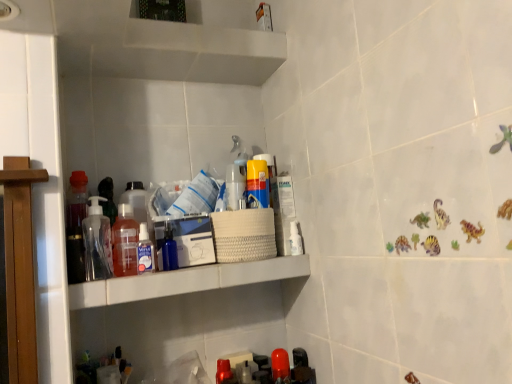
This screenshot has width=512, height=384. What do you see at coordinates (257, 184) in the screenshot? I see `matte plastic can at center, which ranks as the second toiletry in front-to-back order` at bounding box center [257, 184].

In order to face matte plastic can at center, which is counted as the 2th toiletry, starting from the back, should I rotate leftwards or rightwards?

To face it directly, rotate right by 0.769 degrees.

Locate an element on the screen. white plastic shelf at upper center is located at coordinates (185, 281).

What do you see at coordinates (295, 239) in the screenshot?
I see `white plastic bottle at upper right, which is the first toiletry from right to left` at bounding box center [295, 239].

The height and width of the screenshot is (384, 512). What do you see at coordinates (97, 242) in the screenshot?
I see `translucent plastic pump bottle at left, the 3th bottle when ordered from right to left` at bounding box center [97, 242].

Where is `translucent plastic bottle at center, the second bottle positioned from the right`? translucent plastic bottle at center, the second bottle positioned from the right is located at coordinates (125, 242).

Find the location of `matte plastic can at center, the second toiletry when ordered from right to left`. matte plastic can at center, the second toiletry when ordered from right to left is located at coordinates (257, 184).

Can you confirm if transparent plastic spray bottle at upper center, the 1th toiletry positioned from the front, is wider than matte plastic can at center, which is counted as the 2th toiletry, starting from the back?

In fact, transparent plastic spray bottle at upper center, the 1th toiletry positioned from the front, might be narrower than matte plastic can at center, which is counted as the 2th toiletry, starting from the back.

Does transparent plastic spray bottle at upper center, acting as the 3th toiletry starting from the right, have a smaller size compared to matte plastic can at center, which ranks as the second toiletry in front-to-back order?

Yes.

From a real-world perspective, who is located lower, transparent plastic spray bottle at upper center, positioned as the 3th toiletry in back-to-front order, or matte plastic can at center, the second toiletry from the left?

transparent plastic spray bottle at upper center, positioned as the 3th toiletry in back-to-front order, from a real-world perspective.

Measure the distance from transparent plastic spray bottle at upper center, the 1th toiletry when ordered from left to right, to matte plastic can at center, which is counted as the 2th toiletry, starting from the back.

A distance of 11.37 inches exists between transparent plastic spray bottle at upper center, the 1th toiletry when ordered from left to right, and matte plastic can at center, which is counted as the 2th toiletry, starting from the back.

Is white plastic shelf at upper center situated inside transparent plastic bottle at left, the fourth bottle from the right, or outside?

white plastic shelf at upper center is located beyond the bounds of transparent plastic bottle at left, the fourth bottle from the right.

Who is shorter, white plastic shelf at upper center or transparent plastic bottle at left, marked as the first bottle in a left-to-right arrangement?

With less height is white plastic shelf at upper center.

Considering the positions of point (200, 284) and point (67, 252), is point (200, 284) closer or farther from the camera than point (67, 252)?

Point (200, 284) appears to be farther away from the viewer than point (67, 252).

From the image's perspective, relative to transparent plastic bottle at left, the fourth bottle from the right, is white plastic shelf at upper center above or below?

Based on their image positions, white plastic shelf at upper center is located beneath transparent plastic bottle at left, the fourth bottle from the right.

In the scene shown: Is transparent plastic bottle at left, marked as the first bottle in a left-to-right arrangement, not close to translucent plastic bottle at center, the 4th bottle in the left-to-right sequence?

No, there isn't a large distance between transparent plastic bottle at left, marked as the first bottle in a left-to-right arrangement, and translucent plastic bottle at center, the 4th bottle in the left-to-right sequence.

Considering the relative sizes of transparent plastic bottle at left, marked as the first bottle in a left-to-right arrangement, and translucent plastic bottle at center, positioned as the first bottle in right-to-left order, in the image provided, is transparent plastic bottle at left, marked as the first bottle in a left-to-right arrangement, smaller than translucent plastic bottle at center, positioned as the first bottle in right-to-left order,?

Incorrect, transparent plastic bottle at left, marked as the first bottle in a left-to-right arrangement, is not smaller in size than translucent plastic bottle at center, positioned as the first bottle in right-to-left order.

From a real-world perspective, starting from the translucent plastic bottle at center, the 4th bottle in the left-to-right sequence, which bottle is the 1st one below it? Please provide its 2D coordinates.

[(76, 226)]

From the image's perspective, between transparent plastic bottle at left, marked as the first bottle in a left-to-right arrangement, and translucent plastic bottle at center, positioned as the first bottle in right-to-left order, which one is located above?

translucent plastic bottle at center, positioned as the first bottle in right-to-left order, from the image's perspective.

Based on their sizes in the image, would you say translucent plastic bottle at center, positioned as the first bottle in right-to-left order, is bigger or smaller than white plastic shelf at upper center?

In the image, translucent plastic bottle at center, positioned as the first bottle in right-to-left order, appears to be smaller than white plastic shelf at upper center.

You are a GUI agent. You are given a task and a screenshot of the screen. Output one action in this format:
    pyautogui.click(x=<x>, y=<y>)
    Task: Click on the 4th bottle positioned above the white plastic shelf at upper center (from a real-world perspective)
    
    Given the screenshot: What is the action you would take?
    pyautogui.click(x=234, y=185)

How many degrees apart are the facing directions of translucent plastic bottle at center, the 4th bottle in the left-to-right sequence, and white plastic shelf at upper center?

0.00226 degrees.

Is translucent plastic bottle at center, positioned as the first bottle in right-to-left order, aimed at white plastic bottle at upper right, which is the first toiletry from right to left?

No, translucent plastic bottle at center, positioned as the first bottle in right-to-left order, is not oriented towards white plastic bottle at upper right, which is the first toiletry from right to left.

Between translucent plastic bottle at center, positioned as the first bottle in right-to-left order, and white plastic bottle at upper right, the first toiletry when ordered from back to front, which one is positioned in front?

translucent plastic bottle at center, positioned as the first bottle in right-to-left order, is more forward.

Visually, is translucent plastic bottle at center, the 4th bottle in the left-to-right sequence, positioned to the left or to the right of white plastic bottle at upper right, the third toiletry from the left?

translucent plastic bottle at center, the 4th bottle in the left-to-right sequence, is to the left of white plastic bottle at upper right, the third toiletry from the left.

Does translucent plastic bottle at center, the 4th bottle in the left-to-right sequence, touch white plastic bottle at upper right, the first toiletry when ordered from back to front?

translucent plastic bottle at center, the 4th bottle in the left-to-right sequence, and white plastic bottle at upper right, the first toiletry when ordered from back to front, are not in contact.

Which point is more forward, [229,176] or [146,268]?

Positioned in front is point [146,268].

Choose the correct answer: Is translucent plastic bottle at center, the 4th bottle in the left-to-right sequence, inside transparent plastic spray bottle at upper center, acting as the 3th toiletry starting from the right, or outside it?

The correct answer is: outside.

Relative to transparent plastic spray bottle at upper center, the 1th toiletry positioned from the front, is translucent plastic bottle at center, positioned as the first bottle in right-to-left order, in front or behind?

translucent plastic bottle at center, positioned as the first bottle in right-to-left order, is behind transparent plastic spray bottle at upper center, the 1th toiletry positioned from the front.

Considering the relative positions of translucent plastic bottle at center, positioned as the first bottle in right-to-left order, and transparent plastic spray bottle at upper center, acting as the 3th toiletry starting from the right, in the image provided, is translucent plastic bottle at center, positioned as the first bottle in right-to-left order, to the right of transparent plastic spray bottle at upper center, acting as the 3th toiletry starting from the right, from the viewer's perspective?

Yes.

Considering the relative sizes of translucent plastic bottle at center, which is the third bottle from left to right, and transparent plastic bottle at left, marked as the first bottle in a left-to-right arrangement, in the image provided, is translucent plastic bottle at center, which is the third bottle from left to right, taller than transparent plastic bottle at left, marked as the first bottle in a left-to-right arrangement,?

No.

Is translucent plastic bottle at center, which is the third bottle from left to right, aimed at transparent plastic bottle at left, the fourth bottle from the right?

No, translucent plastic bottle at center, which is the third bottle from left to right, is not oriented towards transparent plastic bottle at left, the fourth bottle from the right.

Does translucent plastic bottle at center, the second bottle positioned from the right, have a larger size compared to transparent plastic bottle at left, the fourth bottle from the right?

Actually, translucent plastic bottle at center, the second bottle positioned from the right, might be smaller than transparent plastic bottle at left, the fourth bottle from the right.

At what (x,y) coordinates should I click in order to perform the action: click on toiletry above the transparent plastic spray bottle at upper center, acting as the 3th toiletry starting from the right (from a real-world perspective). Please return your answer as a coordinate pair (x, y). This screenshot has height=384, width=512. Looking at the image, I should click on 257,184.

Locate an element on the screen. the 3rd bottle above the white plastic shelf at upper center (from the image's perspective) is located at coordinates (76, 226).

Looking at the image, which one is located further to transparent plastic spray bottle at upper center, the 1th toiletry positioned from the front, transparent plastic bottle at left, the fourth bottle from the right, or white plastic shelf at upper center?

The object further to transparent plastic spray bottle at upper center, the 1th toiletry positioned from the front, is transparent plastic bottle at left, the fourth bottle from the right.

Looking at the image, which one is located closer to transparent plastic spray bottle at upper center, acting as the 3th toiletry starting from the right, translucent plastic bottle at center, the 4th bottle in the left-to-right sequence, or white plastic shelf at upper center?

Based on the image, white plastic shelf at upper center appears to be nearer to transparent plastic spray bottle at upper center, acting as the 3th toiletry starting from the right.

When comparing their distances from transparent plastic bottle at left, marked as the first bottle in a left-to-right arrangement, does translucent plastic pump bottle at left, the 2th bottle viewed from the left, or translucent plastic bottle at center, positioned as the first bottle in right-to-left order, seem closer?

Based on the image, translucent plastic pump bottle at left, the 2th bottle viewed from the left, appears to be nearer to transparent plastic bottle at left, marked as the first bottle in a left-to-right arrangement.

Looking at the image, which one is located closer to transparent plastic bottle at left, marked as the first bottle in a left-to-right arrangement, translucent plastic bottle at center, the second bottle positioned from the right, or white plastic shelf at upper center?

translucent plastic bottle at center, the second bottle positioned from the right, lies closer to transparent plastic bottle at left, marked as the first bottle in a left-to-right arrangement, than the other object.

From the image, which object appears to be farther from matte plastic can at center, which ranks as the second toiletry in front-to-back order, white plastic shelf at upper center or translucent plastic pump bottle at left, the 3th bottle when ordered from right to left?

Based on the image, translucent plastic pump bottle at left, the 3th bottle when ordered from right to left, appears to be further to matte plastic can at center, which ranks as the second toiletry in front-to-back order.

When comparing their distances from transparent plastic spray bottle at upper center, positioned as the 3th toiletry in back-to-front order, does white plastic bottle at upper right, the 3th toiletry viewed from the front, or transparent plastic bottle at left, the fourth bottle from the right, seem closer?

transparent plastic bottle at left, the fourth bottle from the right, lies closer to transparent plastic spray bottle at upper center, positioned as the 3th toiletry in back-to-front order, than the other object.

Based on their spatial positions, is translucent plastic bottle at center, the second bottle positioned from the right, or transparent plastic bottle at left, marked as the first bottle in a left-to-right arrangement, further from white plastic bottle at upper right, the first toiletry when ordered from back to front?

transparent plastic bottle at left, marked as the first bottle in a left-to-right arrangement, lies further to white plastic bottle at upper right, the first toiletry when ordered from back to front, than the other object.

Looking at the image, which one is located further to white plastic shelf at upper center, translucent plastic bottle at center, positioned as the first bottle in right-to-left order, or matte plastic can at center, the second toiletry from the left?

matte plastic can at center, the second toiletry from the left.

Locate an element on the screen. toiletry between translucent plastic bottle at center, which is the third bottle from left to right, and translucent plastic bottle at center, the 4th bottle in the left-to-right sequence, in the horizontal direction is located at coordinates (145, 251).

The width and height of the screenshot is (512, 384). I want to click on shelf located between transparent plastic bottle at left, the fourth bottle from the right, and translucent plastic bottle at center, positioned as the first bottle in right-to-left order, in the left-right direction, so click(x=185, y=281).

The height and width of the screenshot is (384, 512). Find the location of `toiletry between white plastic shelf at upper center and white plastic bottle at upper right, the first toiletry when ordered from back to front, from left to right`. toiletry between white plastic shelf at upper center and white plastic bottle at upper right, the first toiletry when ordered from back to front, from left to right is located at coordinates (257, 184).

This screenshot has height=384, width=512. What are the coordinates of `toiletry between translucent plastic pump bottle at left, the 2th bottle viewed from the left, and translucent plastic bottle at center, positioned as the first bottle in right-to-left order, from left to right` in the screenshot? It's located at (145, 251).